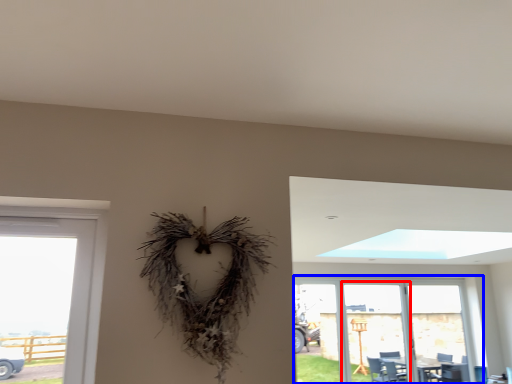
Question: Which object appears closest to the camera in this image, screen door (highlighted by a red box) or window (highlighted by a blue box)?

Choices:
 (A) screen door
 (B) window

Answer: (B)